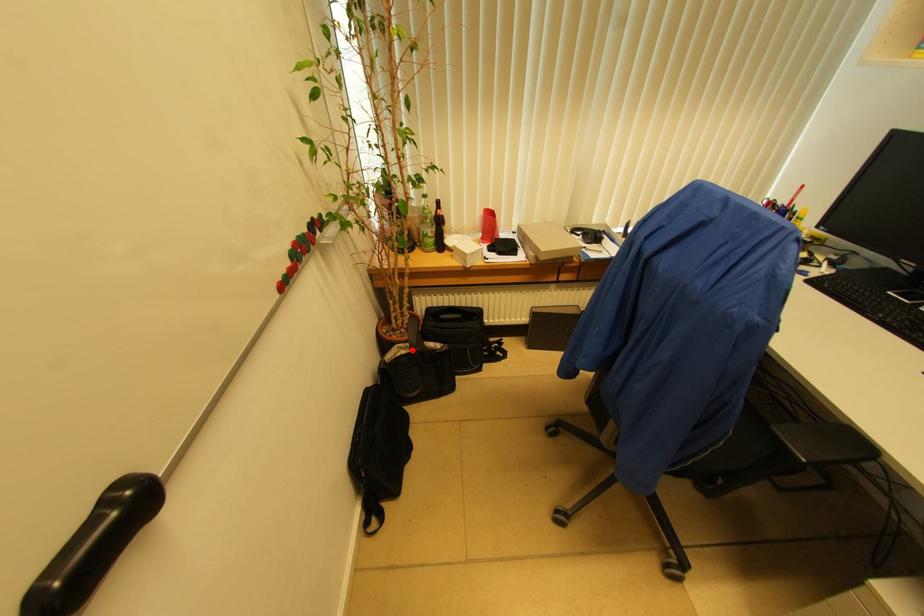
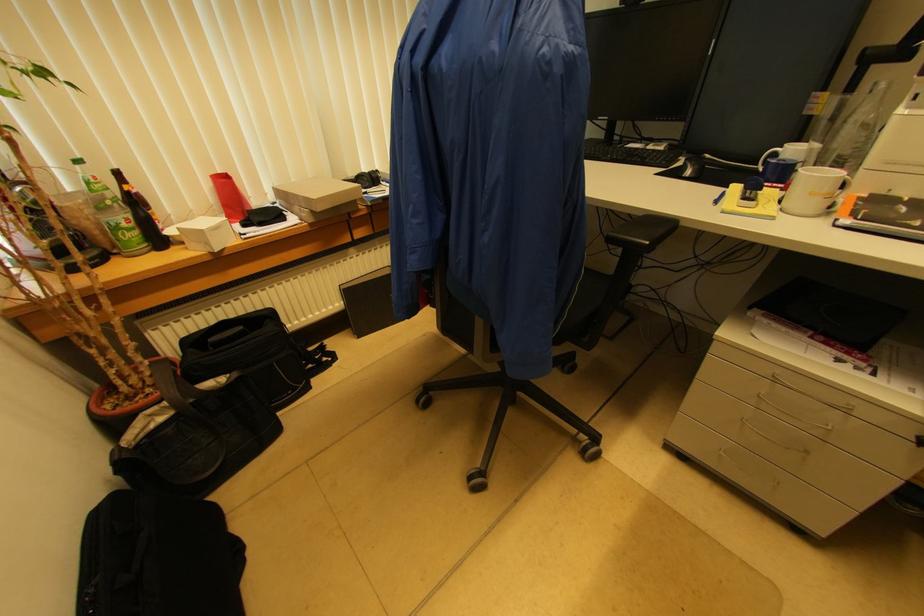
Locate, in the second image, the point that corresponds to the highlighted location in the first image.

(175, 408)